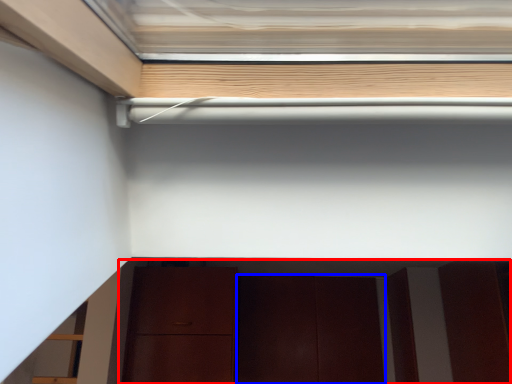
Question: Which of the following is the closest to the observer, cabinetry (highlighted by a red box) or door (highlighted by a blue box)?

Choices:
 (A) cabinetry
 (B) door

Answer: (A)